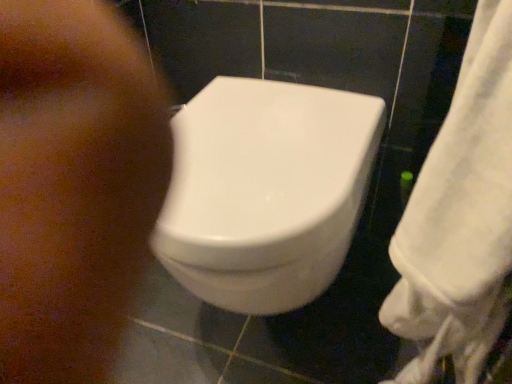
Question: Is brown matte skin at lower left touching white fabric towel at right?

Choices:
 (A) no
 (B) yes

Answer: (A)

Question: From the image's perspective, is brown matte skin at lower left under white fabric towel at right?

Choices:
 (A) yes
 (B) no

Answer: (B)

Question: Is brown matte skin at lower left oriented towards white fabric towel at right?

Choices:
 (A) yes
 (B) no

Answer: (B)

Question: Is brown matte skin at lower left located outside white fabric towel at right?

Choices:
 (A) no
 (B) yes

Answer: (B)

Question: From a real-world perspective, is brown matte skin at lower left located beneath white fabric towel at right?

Choices:
 (A) no
 (B) yes

Answer: (B)

Question: From a real-world perspective, relative to brown matte skin at lower left, is white fabric towel at right vertically above or below?

Choices:
 (A) above
 (B) below

Answer: (A)

Question: Considering the positions of white fabric towel at right and brown matte skin at lower left in the image, is white fabric towel at right taller or shorter than brown matte skin at lower left?

Choices:
 (A) short
 (B) tall

Answer: (B)

Question: Is white fabric towel at right to the left or to the right of brown matte skin at lower left in the image?

Choices:
 (A) right
 (B) left

Answer: (A)

Question: Considering the positions of white fabric towel at right and brown matte skin at lower left in the image, is white fabric towel at right wider or thinner than brown matte skin at lower left?

Choices:
 (A) thin
 (B) wide

Answer: (A)

Question: Does point (233, 175) appear closer or farther from the camera than point (9, 357)?

Choices:
 (A) closer
 (B) farther

Answer: (A)

Question: Which is correct: white glossy toilet at center is inside brown matte skin at lower left, or outside of it?

Choices:
 (A) inside
 (B) outside

Answer: (B)

Question: From the image's perspective, is white glossy toilet at center above or below brown matte skin at lower left?

Choices:
 (A) above
 (B) below

Answer: (B)

Question: Is white glossy toilet at center taller or shorter than brown matte skin at lower left?

Choices:
 (A) short
 (B) tall

Answer: (B)

Question: In the image, is brown matte skin at lower left on the left side or the right side of white fabric towel at right?

Choices:
 (A) right
 (B) left

Answer: (B)

Question: From a real-world perspective, is brown matte skin at lower left physically located above or below white fabric towel at right?

Choices:
 (A) above
 (B) below

Answer: (B)